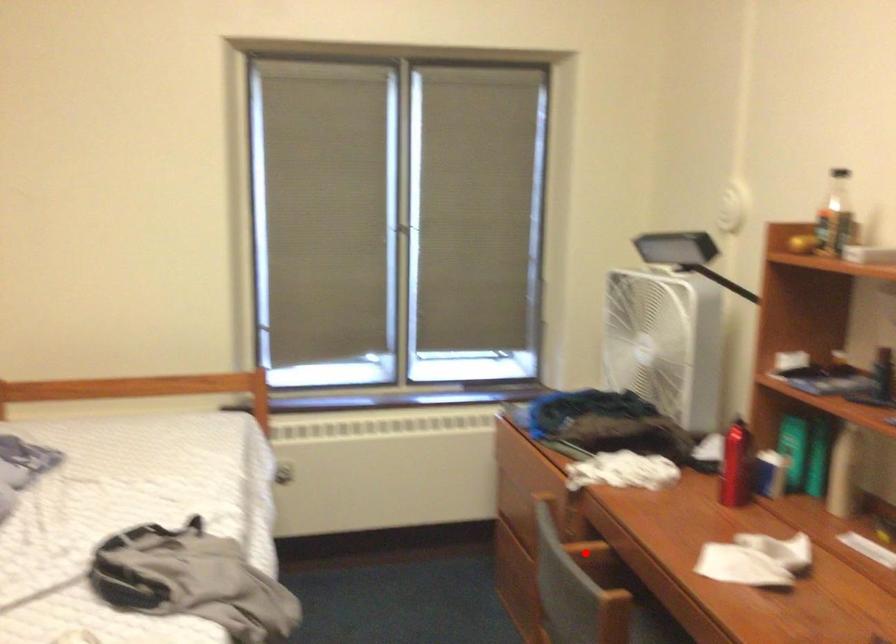
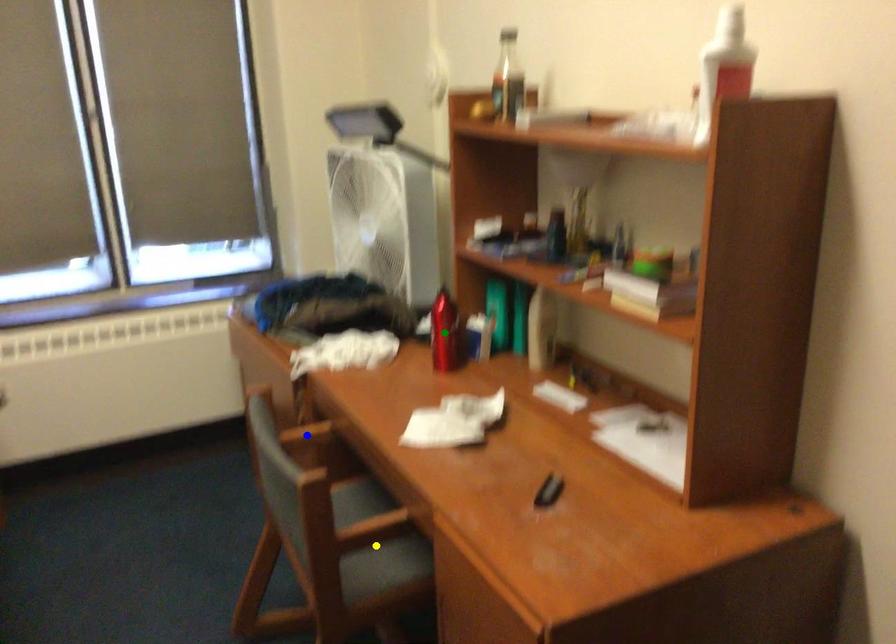
Question: I am providing you with two images of the same scene from different viewpoints. A red point is marked on the first image. You are given multiple points on the second image. In image 2, which mark is for the same physical point as the one in image 1?

Choices:
 (A) blue point
 (B) yellow point
 (C) green point

Answer: (A)